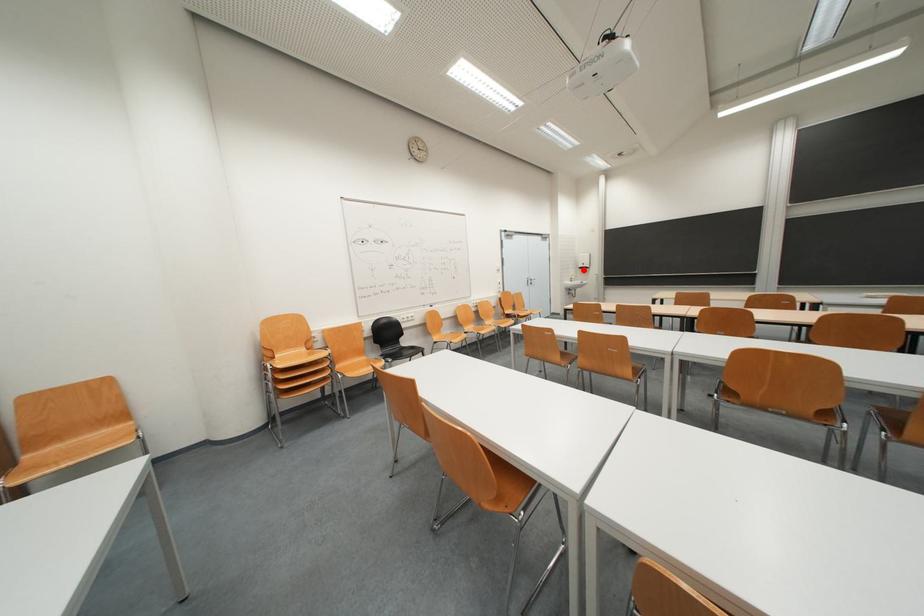
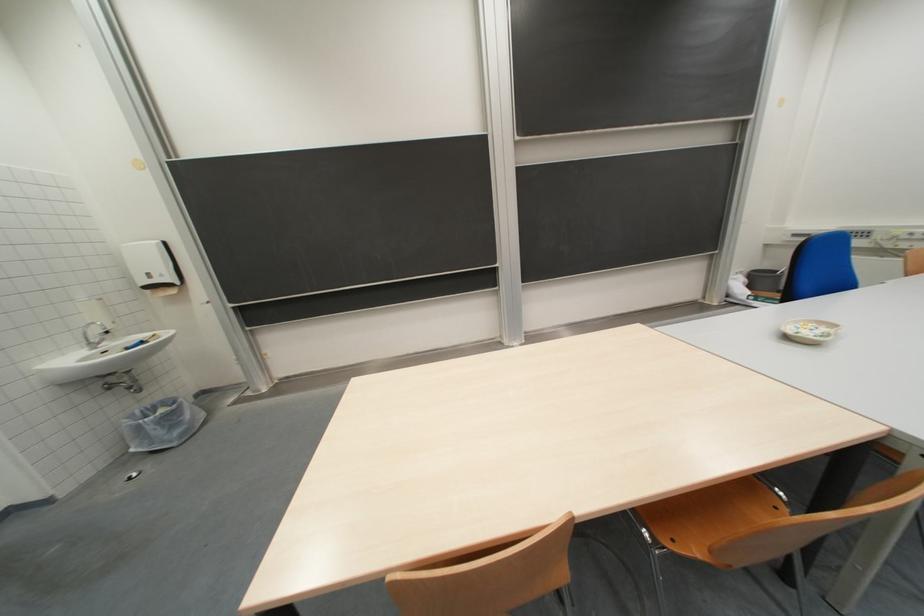
Where in the second image is the point corresponding to the highlighted location from the first image?

(136, 284)